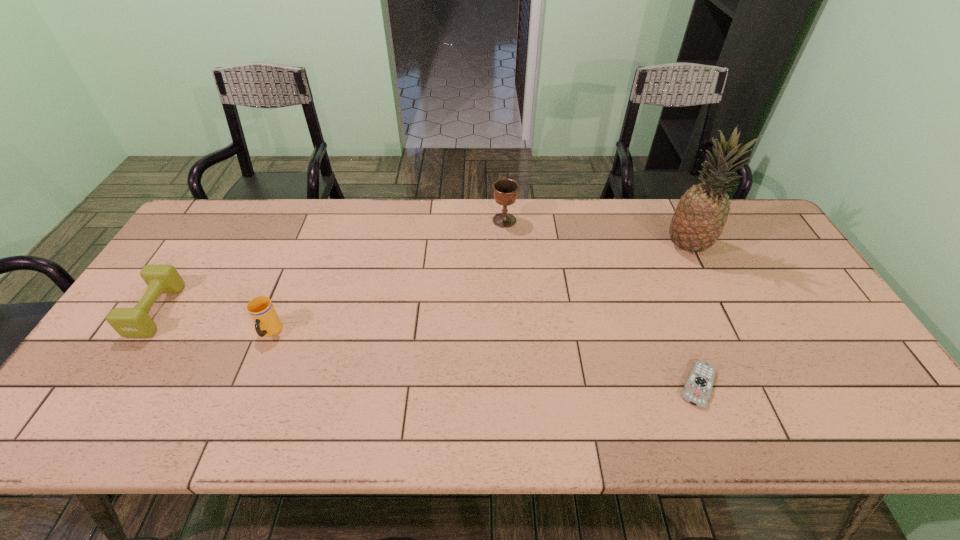
In order to click on vacant area between the third object from right to left and the cup in this screenshot , I will do `click(387, 276)`.

Locate an element on the screen. Image resolution: width=960 pixels, height=540 pixels. vacant area that lies between the leftmost object and the pineapple is located at coordinates (421, 278).

Where is `empty space that is in between the farthest object and the fourth object from right to left`? This screenshot has height=540, width=960. empty space that is in between the farthest object and the fourth object from right to left is located at coordinates (387, 276).

This screenshot has height=540, width=960. Find the location of `object that is the third closest to the chalice`. object that is the third closest to the chalice is located at coordinates (267, 322).

At what (x,y) coordinates should I click in order to perform the action: click on the second closest object to the pineapple. Please return your answer as a coordinate pair (x, y). This screenshot has width=960, height=540. Looking at the image, I should click on (505, 191).

Find the location of a particular element. vacant region that satisfies the following two spatial constraints: 1. on the back side of the rightmost object; 2. on the right side of the fourth object from left to right is located at coordinates (644, 246).

Where is `blank area in the image that satisfies the following two spatial constraints: 1. on the front side of the shortest object; 2. on the right side of the dumbbell`? Image resolution: width=960 pixels, height=540 pixels. blank area in the image that satisfies the following two spatial constraints: 1. on the front side of the shortest object; 2. on the right side of the dumbbell is located at coordinates (107, 385).